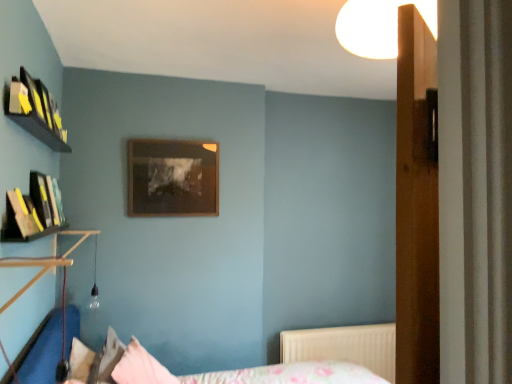
Question: Is pink fabric pillow at lower center, the 2th pillow in the left-to-right sequence, positioned far away from fluffy pink pillow at lower left, the 1th pillow when ordered from left to right?

Choices:
 (A) yes
 (B) no

Answer: (B)

Question: Is pink fabric pillow at lower center, the 2th pillow in the left-to-right sequence, taller than fluffy pink pillow at lower left, which appears as the 2th pillow when viewed from the right?

Choices:
 (A) no
 (B) yes

Answer: (B)

Question: Can you confirm if pink fabric pillow at lower center, which appears as the 1th pillow when viewed from the right, is shorter than fluffy pink pillow at lower left, the 1th pillow when ordered from left to right?

Choices:
 (A) yes
 (B) no

Answer: (B)

Question: Can you confirm if pink fabric pillow at lower center, which appears as the 1th pillow when viewed from the right, is bigger than fluffy pink pillow at lower left, which appears as the 2th pillow when viewed from the right?

Choices:
 (A) yes
 (B) no

Answer: (A)

Question: From the image's perspective, is pink fabric pillow at lower center, the 2th pillow in the left-to-right sequence, above fluffy pink pillow at lower left, the 1th pillow when ordered from left to right?

Choices:
 (A) no
 (B) yes

Answer: (A)

Question: In terms of width, does pink fabric pillow at lower center, the 2th pillow in the left-to-right sequence, look wider or thinner when compared to floral fabric bed at lower center?

Choices:
 (A) wide
 (B) thin

Answer: (B)

Question: Do you think pink fabric pillow at lower center, the 2th pillow in the left-to-right sequence, is within floral fabric bed at lower center, or outside of it?

Choices:
 (A) outside
 (B) inside

Answer: (B)

Question: Based on their sizes in the image, would you say pink fabric pillow at lower center, which appears as the 1th pillow when viewed from the right, is bigger or smaller than floral fabric bed at lower center?

Choices:
 (A) big
 (B) small

Answer: (B)

Question: Is pink fabric pillow at lower center, which appears as the 1th pillow when viewed from the right, taller or shorter than floral fabric bed at lower center?

Choices:
 (A) tall
 (B) short

Answer: (B)

Question: Considering the positions of fluffy pink pillow at lower left, which appears as the 2th pillow when viewed from the right, and wooden picture frame at center in the image, is fluffy pink pillow at lower left, which appears as the 2th pillow when viewed from the right, wider or thinner than wooden picture frame at center?

Choices:
 (A) thin
 (B) wide

Answer: (B)

Question: Is fluffy pink pillow at lower left, the 1th pillow when ordered from left to right, inside the boundaries of wooden picture frame at center, or outside?

Choices:
 (A) outside
 (B) inside

Answer: (A)

Question: Is fluffy pink pillow at lower left, the 1th pillow when ordered from left to right, bigger or smaller than wooden picture frame at center?

Choices:
 (A) small
 (B) big

Answer: (A)

Question: From a real-world perspective, is fluffy pink pillow at lower left, which appears as the 2th pillow when viewed from the right, positioned above or below wooden picture frame at center?

Choices:
 (A) below
 (B) above

Answer: (A)

Question: From the image's perspective, is floral fabric bed at lower center located above or below white textured radiator at lower right?

Choices:
 (A) above
 (B) below

Answer: (A)

Question: Looking at their shapes, would you say floral fabric bed at lower center is wider or thinner than white textured radiator at lower right?

Choices:
 (A) thin
 (B) wide

Answer: (B)